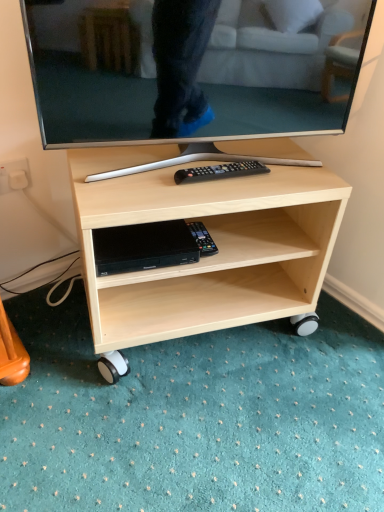
Find the location of a particular element. The width and height of the screenshot is (384, 512). vacant space behind black plastic remote at center is located at coordinates (249, 150).